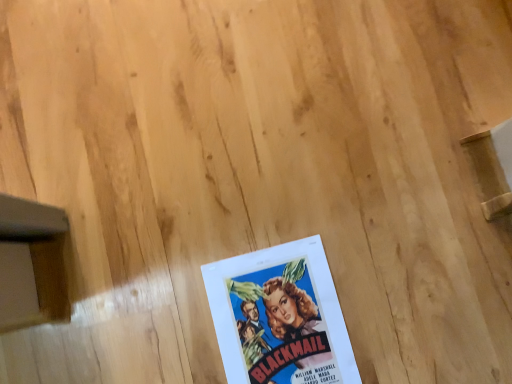
This screenshot has width=512, height=384. What do you see at coordinates (280, 317) in the screenshot? I see `matte paper poster at center` at bounding box center [280, 317].

Identify the location of matte paper poster at center. Image resolution: width=512 pixels, height=384 pixels. (280, 317).

At what (x,y) coordinates should I click in order to perform the action: click on matte paper poster at center. Please return your answer as a coordinate pair (x, y). This screenshot has height=384, width=512. Looking at the image, I should click on (280, 317).